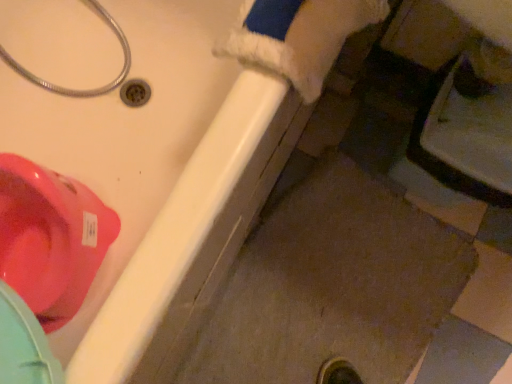
Question: Is glossy plastic toilet at upper left positioned far away from metallic silver hose at upper left?

Choices:
 (A) no
 (B) yes

Answer: (A)

Question: Is glossy plastic toilet at upper left behind metallic silver hose at upper left?

Choices:
 (A) no
 (B) yes

Answer: (B)

Question: Is glossy plastic toilet at upper left bigger than metallic silver hose at upper left?

Choices:
 (A) yes
 (B) no

Answer: (B)

Question: Is glossy plastic toilet at upper left positioned with its back to metallic silver hose at upper left?

Choices:
 (A) yes
 (B) no

Answer: (B)

Question: From a real-world perspective, is glossy plastic toilet at upper left below metallic silver hose at upper left?

Choices:
 (A) no
 (B) yes

Answer: (B)

Question: Can you confirm if glossy plastic toilet at upper left is smaller than metallic silver hose at upper left?

Choices:
 (A) yes
 (B) no

Answer: (A)

Question: Could you tell me if glossy plastic toilet at upper left is turned towards matte white bathtub at lower left?

Choices:
 (A) yes
 (B) no

Answer: (A)

Question: Does glossy plastic toilet at upper left appear on the left side of matte white bathtub at lower left?

Choices:
 (A) yes
 (B) no

Answer: (A)

Question: Does glossy plastic toilet at upper left have a greater height compared to matte white bathtub at lower left?

Choices:
 (A) yes
 (B) no

Answer: (B)

Question: From the image's perspective, is glossy plastic toilet at upper left under matte white bathtub at lower left?

Choices:
 (A) yes
 (B) no

Answer: (A)

Question: From a real-world perspective, is glossy plastic toilet at upper left over matte white bathtub at lower left?

Choices:
 (A) no
 (B) yes

Answer: (A)

Question: Is glossy plastic toilet at upper left looking in the opposite direction of matte white bathtub at lower left?

Choices:
 (A) yes
 (B) no

Answer: (A)

Question: Is there a large distance between matte white bathtub at lower left and glossy plastic toilet at upper left?

Choices:
 (A) no
 (B) yes

Answer: (A)